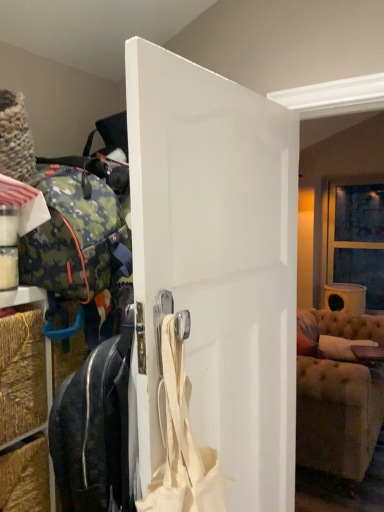
This screenshot has height=512, width=384. Describe the element at coordinates (94, 429) in the screenshot. I see `black leather suitcase at center, placed as the 1th luggage and bags when sorted from bottom to top` at that location.

Find the location of a particular element. Image resolution: width=384 pixels, height=512 pixels. beige fabric shoulder bag at center is located at coordinates coord(182,440).

The width and height of the screenshot is (384, 512). What do you see at coordinates (217, 265) in the screenshot? I see `white matte door at center` at bounding box center [217, 265].

Find the location of `camo fabric backpack at left, the 2th luggage and bags ordered from the bottom`. camo fabric backpack at left, the 2th luggage and bags ordered from the bottom is located at coordinates (80, 248).

The image size is (384, 512). I want to click on black leather suitcase at center, placed as the 1th luggage and bags when sorted from bottom to top, so click(94, 429).

In the image, is beige fabric shoulder bag at center on the left side or the right side of camo fabric backpack at left, which is counted as the 1th luggage and bags, starting from the top?

In the image, beige fabric shoulder bag at center appears on the right side of camo fabric backpack at left, which is counted as the 1th luggage and bags, starting from the top.

From the image's perspective, does beige fabric shoulder bag at center appear higher than camo fabric backpack at left, the 2th luggage and bags ordered from the bottom?

No.

From a real-world perspective, which object rests below the other?

beige fabric shoulder bag at center is physically lower.

Is beige fabric shoulder bag at center spatially inside camo fabric backpack at left, which is counted as the 1th luggage and bags, starting from the top, or outside of it?

beige fabric shoulder bag at center is not enclosed by camo fabric backpack at left, which is counted as the 1th luggage and bags, starting from the top.

From the image's perspective, is clear glass window at upper right located above or below white matte door at center?

Based on their image positions, clear glass window at upper right is located above white matte door at center.

Considering the relative positions of clear glass window at upper right and white matte door at center in the image provided, is clear glass window at upper right to the right of white matte door at center from the viewer's perspective?

Yes.

In terms of height, does clear glass window at upper right look taller or shorter compared to white matte door at center?

In the image, clear glass window at upper right appears to be shorter than white matte door at center.

Find the location of `studio couch lying on the right of camo fabric backpack at left, the 2th luggage and bags ordered from the bottom`. studio couch lying on the right of camo fabric backpack at left, the 2th luggage and bags ordered from the bottom is located at coordinates (338, 415).

Based on the photo, would you say camo fabric backpack at left, which is counted as the 1th luggage and bags, starting from the top, is to the left or to the right of tufted fabric couch at right in the picture?

camo fabric backpack at left, which is counted as the 1th luggage and bags, starting from the top, is to the left of tufted fabric couch at right.

Consider the image. From a real-world perspective, who is located lower, camo fabric backpack at left, which is counted as the 1th luggage and bags, starting from the top, or tufted fabric couch at right?

tufted fabric couch at right.

How different are the orientations of white matte door at center and camo fabric backpack at left, the 2th luggage and bags ordered from the bottom, in degrees?

The facing directions of white matte door at center and camo fabric backpack at left, the 2th luggage and bags ordered from the bottom, are 6.4 degrees apart.

Is white matte door at center further to the viewer compared to camo fabric backpack at left, which is counted as the 1th luggage and bags, starting from the top?

No, white matte door at center is closer to the viewer.

Identify the location of door that appears on the right of camo fabric backpack at left, the 2th luggage and bags ordered from the bottom. (217, 265).

Does white matte door at center appear on the right side of camo fabric backpack at left, the 2th luggage and bags ordered from the bottom?

Yes.

Is black leather suitcase at center, placed as the 1th luggage and bags when sorted from bottom to top, inside or outside of tufted fabric couch at right?

The correct answer is: outside.

Does black leather suitcase at center, which appears as the 2th luggage and bags when viewed from the top, touch tufted fabric couch at right?

black leather suitcase at center, which appears as the 2th luggage and bags when viewed from the top, and tufted fabric couch at right are not in contact.

Looking at the image, does black leather suitcase at center, which appears as the 2th luggage and bags when viewed from the top, seem bigger or smaller compared to tufted fabric couch at right?

In the image, black leather suitcase at center, which appears as the 2th luggage and bags when viewed from the top, appears to be smaller than tufted fabric couch at right.

Does black leather suitcase at center, placed as the 1th luggage and bags when sorted from bottom to top, have a lesser height compared to tufted fabric couch at right?

Yes, black leather suitcase at center, placed as the 1th luggage and bags when sorted from bottom to top, is shorter than tufted fabric couch at right.

Consider the image. Is camo fabric backpack at left, which is counted as the 1th luggage and bags, starting from the top, bigger or smaller than clear glass window at upper right?

camo fabric backpack at left, which is counted as the 1th luggage and bags, starting from the top, is bigger than clear glass window at upper right.

From a real-world perspective, is camo fabric backpack at left, which is counted as the 1th luggage and bags, starting from the top, below clear glass window at upper right?

Actually, camo fabric backpack at left, which is counted as the 1th luggage and bags, starting from the top, is physically above clear glass window at upper right in the real world.

Which of these two, camo fabric backpack at left, the 2th luggage and bags ordered from the bottom, or clear glass window at upper right, stands taller?

Standing taller between the two is clear glass window at upper right.

From the image's perspective, which is below, camo fabric backpack at left, which is counted as the 1th luggage and bags, starting from the top, or clear glass window at upper right?

camo fabric backpack at left, which is counted as the 1th luggage and bags, starting from the top, appears lower in the image.

Is camo fabric backpack at left, the 2th luggage and bags ordered from the bottom, in front of or behind white matte door at center in the image?

Visually, camo fabric backpack at left, the 2th luggage and bags ordered from the bottom, is located behind white matte door at center.

Is camo fabric backpack at left, which is counted as the 1th luggage and bags, starting from the top, completely or partially outside of white matte door at center?

Yes, camo fabric backpack at left, which is counted as the 1th luggage and bags, starting from the top, is located beyond the bounds of white matte door at center.

Can you confirm if camo fabric backpack at left, the 2th luggage and bags ordered from the bottom, is wider than white matte door at center?

Correct, the width of camo fabric backpack at left, the 2th luggage and bags ordered from the bottom, exceeds that of white matte door at center.

Is camo fabric backpack at left, which is counted as the 1th luggage and bags, starting from the top, at the left side of white matte door at center?

Indeed, camo fabric backpack at left, which is counted as the 1th luggage and bags, starting from the top, is positioned on the left side of white matte door at center.

Locate an element on the screen. This screenshot has height=512, width=384. shoulder bag on the right of camo fabric backpack at left, which is counted as the 1th luggage and bags, starting from the top is located at coordinates (182, 440).

Locate an element on the screen. window behind the white matte door at center is located at coordinates (356, 234).

From the image, which object appears to be nearer to black leather suitcase at center, which appears as the 2th luggage and bags when viewed from the top, camo fabric backpack at left, the 2th luggage and bags ordered from the bottom, or beige fabric shoulder bag at center?

beige fabric shoulder bag at center is positioned closer to the anchor black leather suitcase at center, which appears as the 2th luggage and bags when viewed from the top.

Considering their positions, is black leather suitcase at center, placed as the 1th luggage and bags when sorted from bottom to top, positioned closer to clear glass window at upper right than beige fabric shoulder bag at center?

The object closer to clear glass window at upper right is beige fabric shoulder bag at center.

When comparing their distances from white matte door at center, does black leather suitcase at center, which appears as the 2th luggage and bags when viewed from the top, or camo fabric backpack at left, which is counted as the 1th luggage and bags, starting from the top, seem closer?

black leather suitcase at center, which appears as the 2th luggage and bags when viewed from the top, lies closer to white matte door at center than the other object.

Looking at the image, which one is located closer to camo fabric backpack at left, the 2th luggage and bags ordered from the bottom, beige fabric shoulder bag at center or white matte door at center?

white matte door at center.

From the image, which object appears to be nearer to tufted fabric couch at right, camo fabric backpack at left, the 2th luggage and bags ordered from the bottom, or clear glass window at upper right?

clear glass window at upper right lies closer to tufted fabric couch at right than the other object.

In the scene shown: From the image, which object appears to be farther from tufted fabric couch at right, beige fabric shoulder bag at center or white matte door at center?

beige fabric shoulder bag at center is positioned further to the anchor tufted fabric couch at right.

Based on the photo, considering their positions, is camo fabric backpack at left, the 2th luggage and bags ordered from the bottom, positioned further to clear glass window at upper right than white matte door at center?

Based on the image, camo fabric backpack at left, the 2th luggage and bags ordered from the bottom, appears to be further to clear glass window at upper right.

Based on their spatial positions, is clear glass window at upper right or black leather suitcase at center, placed as the 1th luggage and bags when sorted from bottom to top, further from white matte door at center?

Among the two, clear glass window at upper right is located further to white matte door at center.

The image size is (384, 512). Find the location of `studio couch between black leather suitcase at center, placed as the 1th luggage and bags when sorted from bottom to top, and clear glass window at upper right, along the z-axis`. studio couch between black leather suitcase at center, placed as the 1th luggage and bags when sorted from bottom to top, and clear glass window at upper right, along the z-axis is located at coordinates (338, 415).

You are a GUI agent. You are given a task and a screenshot of the screen. Output one action in this format:
    pyautogui.click(x=<x>, y=<y>)
    Task: Click on the luggage and bags located between camo fabric backpack at left, which is counted as the 1th luggage and bags, starting from the top, and white matte door at center in the left-right direction
    
    Given the screenshot: What is the action you would take?
    pyautogui.click(x=94, y=429)

Identify the location of door positioned between beige fabric shoulder bag at center and tufted fabric couch at right from near to far. (217, 265).

Locate an element on the screen. studio couch located between white matte door at center and clear glass window at upper right in the depth direction is located at coordinates (338, 415).